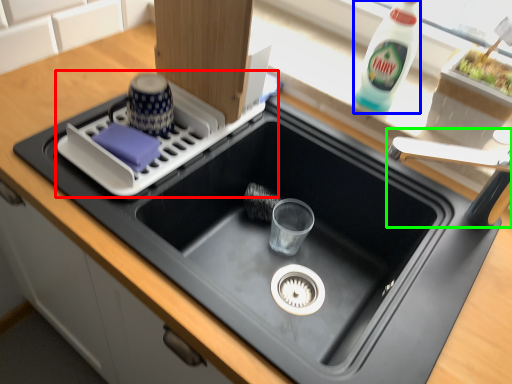
Question: Estimate the real-world distances between objects in this image. Which object is farther from appliance (highlighted by a red box), bottle (highlighted by a blue box) or faucet (highlighted by a green box)?

Choices:
 (A) bottle
 (B) faucet

Answer: (B)